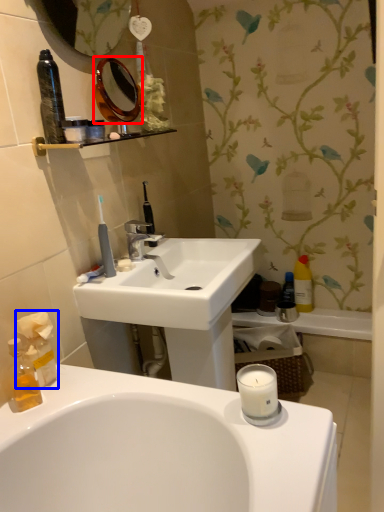
Question: Which object is further to the camera taking this photo, mirror (highlighted by a red box) or tissue (highlighted by a blue box)?

Choices:
 (A) mirror
 (B) tissue

Answer: (A)